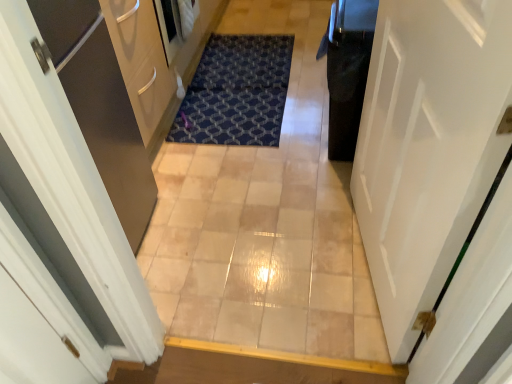
This screenshot has width=512, height=384. I want to click on vacant area that lies between white glossy door at right and blue textured mat at center, so click(x=283, y=197).